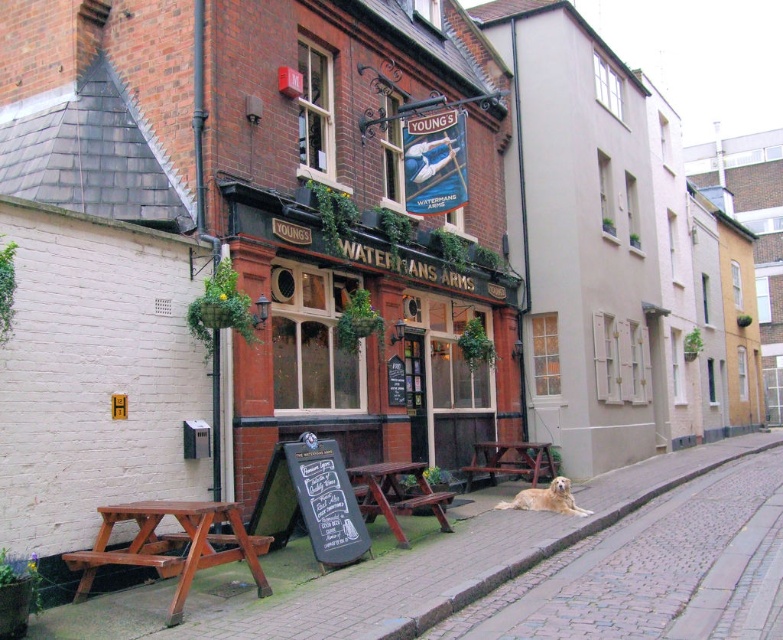
Does cobblestone pavement at lower right appear on the left side of wooden picnic table at lower left?

Incorrect, cobblestone pavement at lower right is not on the left side of wooden picnic table at lower left.

What do you see at coordinates (626, 564) in the screenshot?
I see `cobblestone pavement at lower right` at bounding box center [626, 564].

Locate an element on the screen. The height and width of the screenshot is (640, 783). cobblestone pavement at lower right is located at coordinates pyautogui.click(x=626, y=564).

Does point (150, 589) come behind point (695, 512)?

No, it is in front of (695, 512).

Between brown wooden pavement at lower left and cobblestone pavement at lower right, which one has more height?

Standing taller between the two is brown wooden pavement at lower left.

Does point (723, 444) come behind point (637, 577)?

Yes, point (723, 444) is farther from viewer.

Locate an element on the screen. The width and height of the screenshot is (783, 640). brown wooden pavement at lower left is located at coordinates (395, 570).

Does wooden picnic table at lower left have a greater width compared to brown wooden picnic table at center?

Yes, wooden picnic table at lower left is wider than brown wooden picnic table at center.

Does wooden picnic table at lower left lie behind brown wooden picnic table at center?

No, it is in front of brown wooden picnic table at center.

Which is in front, point (174, 545) or point (524, 467)?

Positioned in front is point (174, 545).

Find the location of a particular element. Image resolution: width=783 pixels, height=640 pixels. wooden picnic table at lower left is located at coordinates (172, 545).